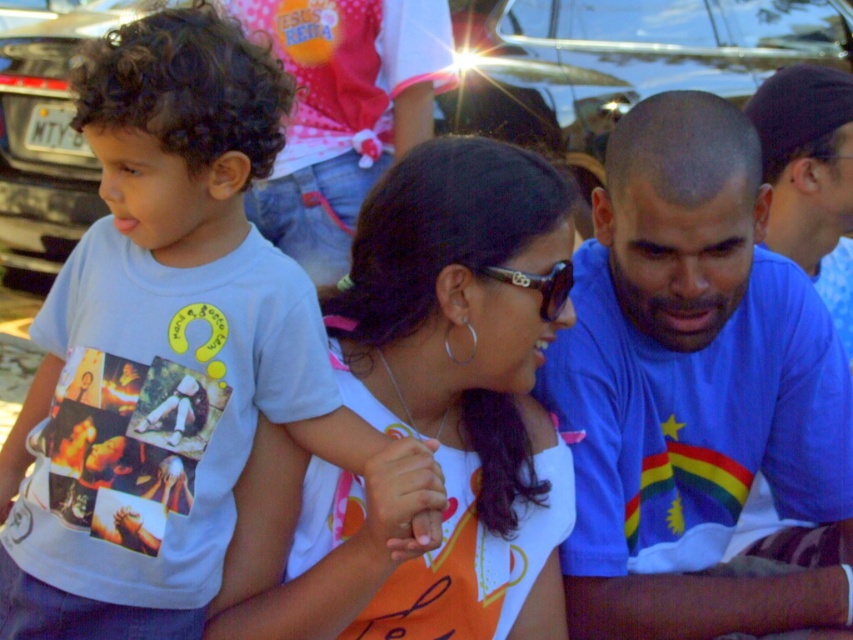
Between blue cotton shirt at center and white cotton shirt at center, which one appears on the right side from the viewer's perspective?

From the viewer's perspective, blue cotton shirt at center appears more on the right side.

Is blue cotton shirt at center positioned in front of white cotton shirt at center?

No, blue cotton shirt at center is behind white cotton shirt at center.

Who is more forward, (704, 429) or (426, 420)?

Point (426, 420) is in front.

Find the location of a particular element. The image size is (853, 640). blue cotton shirt at center is located at coordinates (694, 390).

Is white cotton shirt at center taller than shiny black car at upper center?

Incorrect, white cotton shirt at center's height is not larger of shiny black car at upper center's.

Is white cotton shirt at center smaller than shiny black car at upper center?

Correct, white cotton shirt at center occupies less space than shiny black car at upper center.

Which is in front, point (419, 225) or point (543, 93)?

Point (419, 225)

Locate an element on the screen. Image resolution: width=853 pixels, height=640 pixels. white cotton shirt at center is located at coordinates (422, 424).

Is white printed t-shirt at left above white cotton shirt at center?

Yes.

Does white printed t-shirt at left have a greater width compared to white cotton shirt at center?

Yes.

Does point (224, 321) lie behind point (296, 449)?

No, it is not.

This screenshot has height=640, width=853. I want to click on white printed t-shirt at left, so click(161, 344).